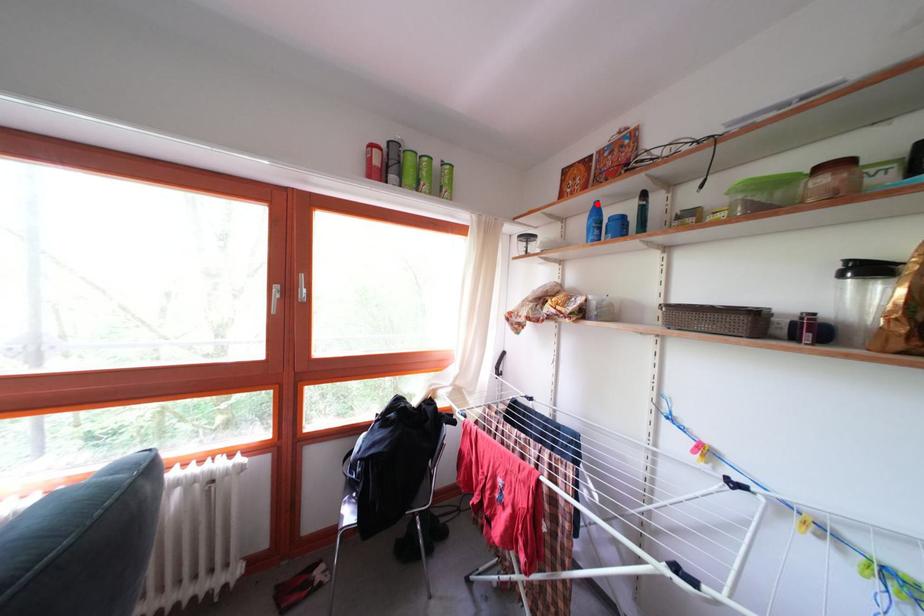
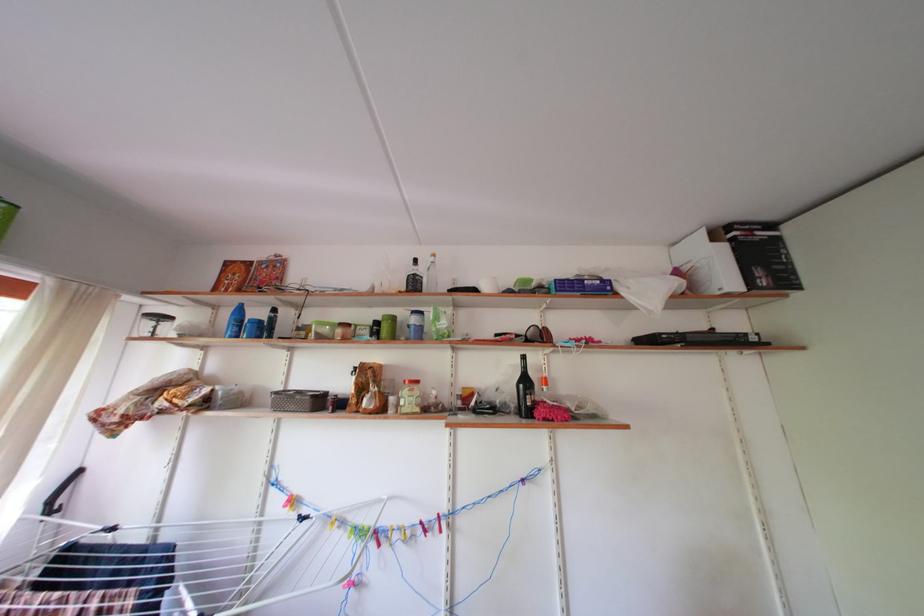
Where in the second image is the point corresponding to the highlighted location from the first image?

(242, 305)